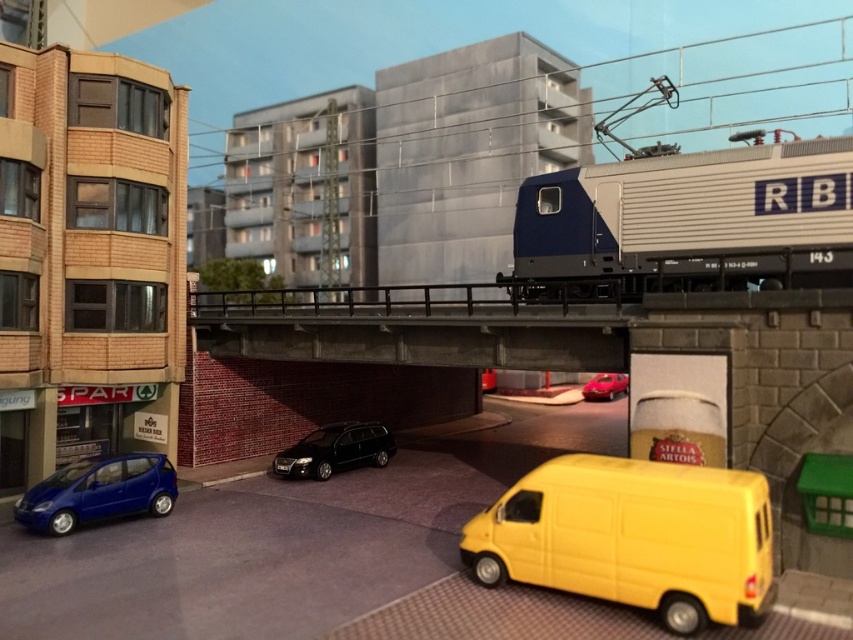
Who is more forward, (729, 611) or (503, 333)?

Point (729, 611) is in front.

Does yellow matte van at lower right have a lesser height compared to concrete bridge at center?

Yes.

Is point (689, 516) positioned in front of point (440, 320)?

Yes, point (689, 516) is in front of point (440, 320).

Locate an element on the screen. yellow matte van at lower right is located at coordinates (633, 538).

Does point (111, 493) lie in front of point (358, 440)?

Yes, it is.

Between point (163, 515) and point (312, 435), which one is positioned in front?

Point (163, 515) is more forward.

Identify the location of metallic blue hatchback at lower left. Image resolution: width=853 pixels, height=640 pixels. (97, 492).

Which is more to the left, concrete bridge at center or shiny red car at center?

concrete bridge at center is more to the left.

Is point (517, 317) in front of point (601, 380)?

Yes, point (517, 317) is closer to viewer.

Identify the location of concrete bridge at center. Image resolution: width=853 pixels, height=640 pixels. (412, 326).